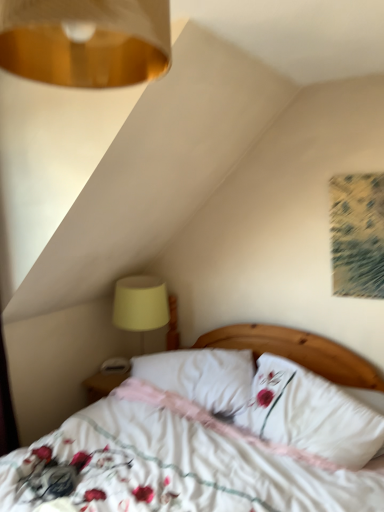
Question: Which direction should I rotate to look at white soft pillow at center, arranged as the first pillow when viewed from the left, — up or down?

Choices:
 (A) up
 (B) down

Answer: (B)

Question: Is printed fabric artwork at upper right taller than white floral fabric bed at center?

Choices:
 (A) yes
 (B) no

Answer: (B)

Question: Is printed fabric artwork at upper right facing away from white floral fabric bed at center?

Choices:
 (A) no
 (B) yes

Answer: (A)

Question: Does printed fabric artwork at upper right appear on the left side of white floral fabric bed at center?

Choices:
 (A) yes
 (B) no

Answer: (B)

Question: From the image's perspective, is printed fabric artwork at upper right beneath white floral fabric bed at center?

Choices:
 (A) yes
 (B) no

Answer: (B)

Question: Can you confirm if printed fabric artwork at upper right is wider than white floral fabric bed at center?

Choices:
 (A) no
 (B) yes

Answer: (A)

Question: Is printed fabric artwork at upper right beside white floral fabric bed at center?

Choices:
 (A) yes
 (B) no

Answer: (B)

Question: Does white soft pillow at center, the 2th pillow from the left, turn towards gold metallic lampshade at upper left?

Choices:
 (A) no
 (B) yes

Answer: (A)

Question: Can you confirm if white soft pillow at center, the 2th pillow from the left, is thinner than gold metallic lampshade at upper left?

Choices:
 (A) no
 (B) yes

Answer: (B)

Question: Considering the relative sizes of white soft pillow at center, the 1th pillow positioned from the right, and gold metallic lampshade at upper left in the image provided, is white soft pillow at center, the 1th pillow positioned from the right, smaller than gold metallic lampshade at upper left?

Choices:
 (A) no
 (B) yes

Answer: (A)

Question: Is white soft pillow at center, the 1th pillow positioned from the right, in front of gold metallic lampshade at upper left?

Choices:
 (A) no
 (B) yes

Answer: (A)

Question: Is white soft pillow at center, the 2th pillow from the left, to the left of gold metallic lampshade at upper left from the viewer's perspective?

Choices:
 (A) yes
 (B) no

Answer: (B)

Question: From the image's perspective, does white soft pillow at center, the 1th pillow positioned from the right, appear lower than gold metallic lampshade at upper left?

Choices:
 (A) yes
 (B) no

Answer: (A)

Question: From the image's perspective, is gold metallic lampshade at upper left on white soft pillow at center, the 1th pillow positioned from the right?

Choices:
 (A) no
 (B) yes

Answer: (B)